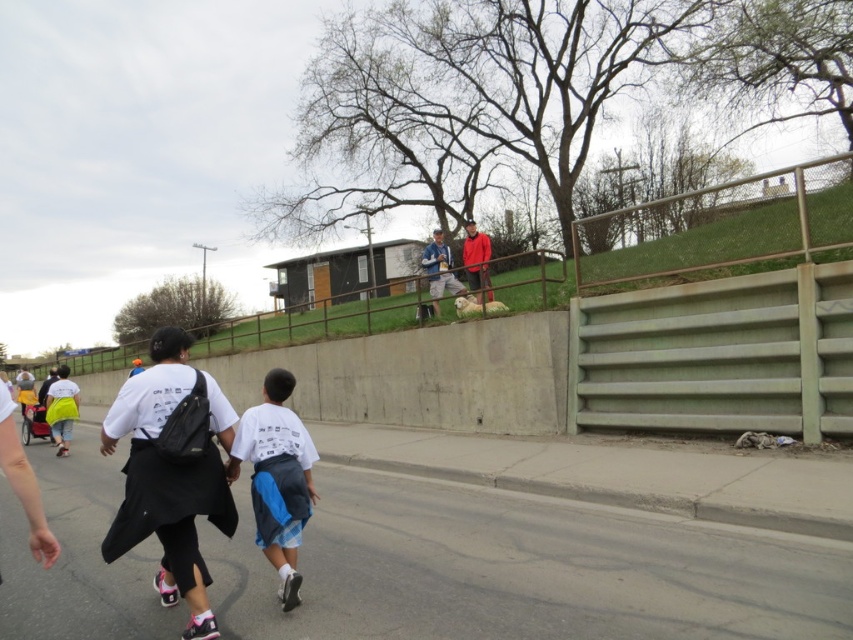
You are a GUI agent. You are given a task and a screenshot of the screen. Output one action in this format:
    pyautogui.click(x=<x>, y=<y>)
    Task: Click on the white cotton shirt at center
    The height and width of the screenshot is (640, 853).
    Given the screenshot: What is the action you would take?
    pyautogui.click(x=277, y=477)

Measure the distance between white cotton shirt at center and camera.

white cotton shirt at center and camera are 13.38 feet apart from each other.

This screenshot has width=853, height=640. I want to click on white cotton shirt at center, so click(x=277, y=477).

Looking at this image, can you confirm if white cotton shirt at center is shorter than matte blue shirt at center?

Indeed, white cotton shirt at center has a lesser height compared to matte blue shirt at center.

Based on the photo, who is more distant from viewer, (292, 554) or (447, 260)?

Positioned behind is point (447, 260).

Describe the element at coordinates (277, 477) in the screenshot. I see `white cotton shirt at center` at that location.

At what (x,y) coordinates should I click in order to perform the action: click on white cotton shirt at center. Please return your answer as a coordinate pair (x, y). Looking at the image, I should click on (277, 477).

Is matte blue shirt at center positioned in front of matte red jacket at upper center?

No, it is behind matte red jacket at upper center.

Between matte blue shirt at center and matte red jacket at upper center, which one appears on the left side from the viewer's perspective?

Positioned to the left is matte blue shirt at center.

Find the location of `matte blue shirt at center`. matte blue shirt at center is located at coordinates (439, 269).